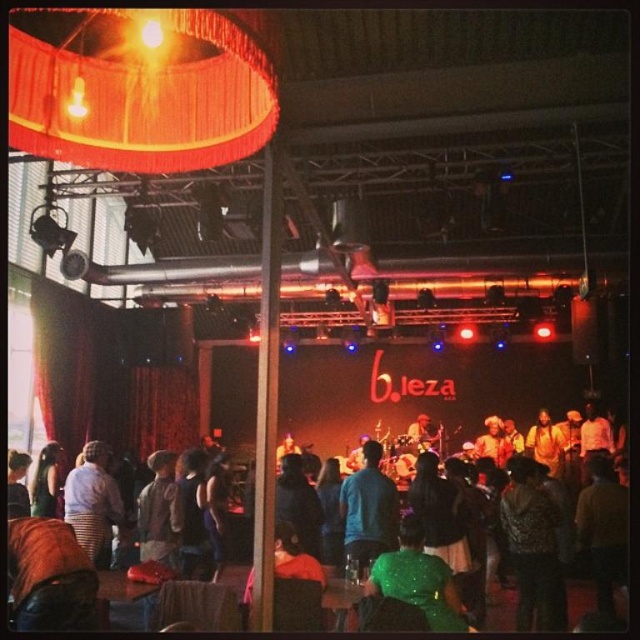
Question: Considering the real-world distances, which object is farthest from the blue denim jacket at center?

Choices:
 (A) green sequined dress at center
 (B) striped shirt at lower left

Answer: (A)

Question: Which point is farther to the camera?

Choices:
 (A) (572, 620)
 (B) (371, 465)

Answer: (A)

Question: Which of the following is the farthest from the observer?

Choices:
 (A) (364, 468)
 (B) (570, 604)
 (C) (74, 481)

Answer: (B)

Question: Does blue denim jacket at center appear over green sequined dress at center?

Choices:
 (A) yes
 (B) no

Answer: (A)

Question: Is striped shirt at lower left below green sequined dress at center?

Choices:
 (A) yes
 (B) no

Answer: (B)

Question: Is blue denim jacket at center smaller than green sequined dress at center?

Choices:
 (A) yes
 (B) no

Answer: (B)